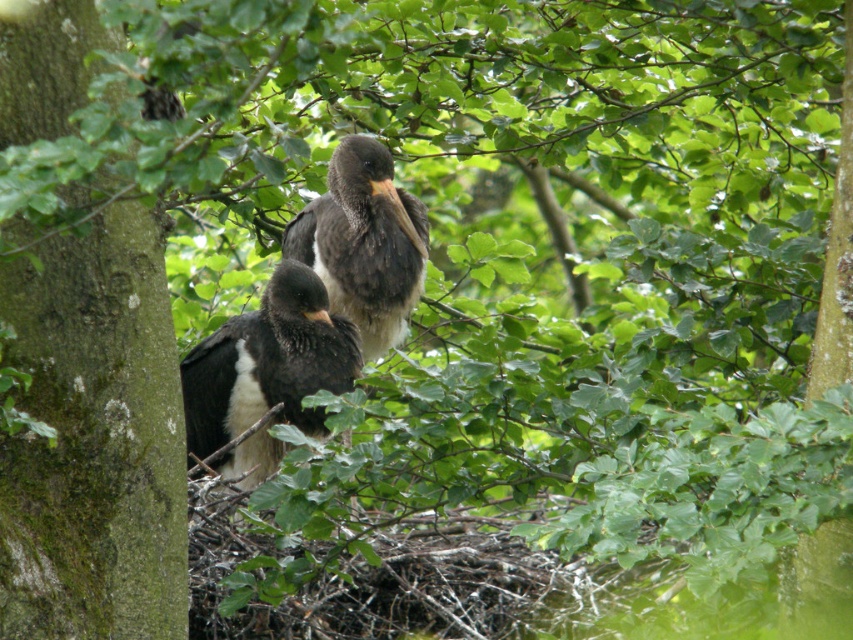
From the picture: Measure the distance from dark brown feathers at center to dark gray feathers at center.

The distance of dark brown feathers at center from dark gray feathers at center is 7.47 inches.

At what (x,y) coordinates should I click in order to perform the action: click on dark brown feathers at center. Please return your answer as a coordinate pair (x, y). Image resolution: width=853 pixels, height=640 pixels. Looking at the image, I should click on (268, 362).

This screenshot has height=640, width=853. Identify the location of dark brown feathers at center. (268, 362).